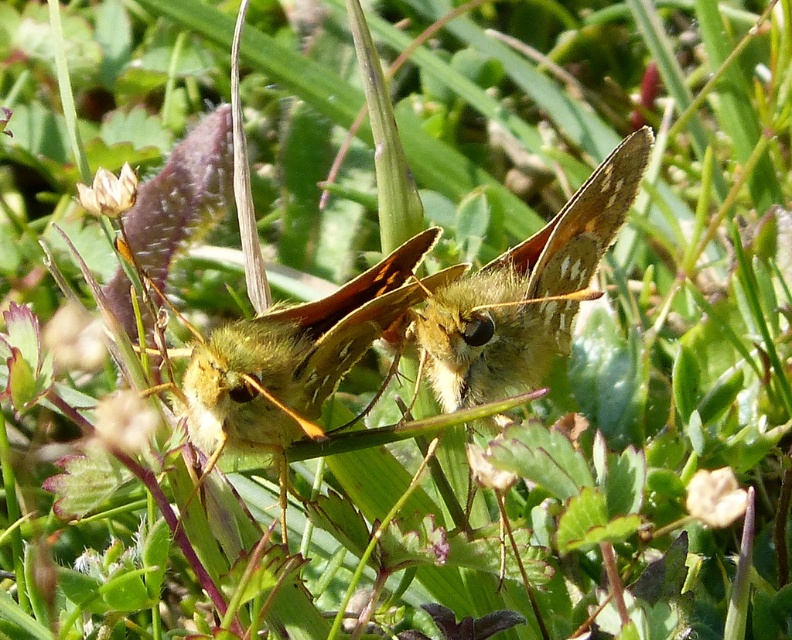
Is point (508, 321) farther from camera compared to point (280, 426)?

Yes, point (508, 321) is farther from viewer.

Can you confirm if fuzzy yellow butterfly at center is positioned below green fuzzy butterfly at center?

No, fuzzy yellow butterfly at center is not below green fuzzy butterfly at center.

Image resolution: width=792 pixels, height=640 pixels. I want to click on fuzzy yellow butterfly at center, so click(520, 294).